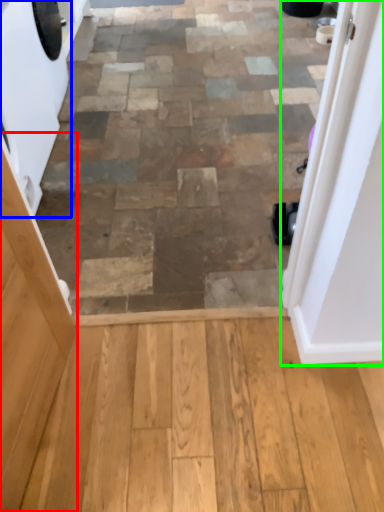
Question: Which object is positioned farthest from screen door (highlighted by a red box)? Select from washing machine (highlighted by a blue box) and door (highlighted by a green box).

Choices:
 (A) washing machine
 (B) door

Answer: (A)